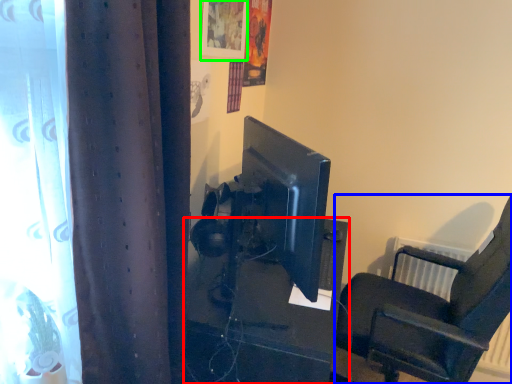
Question: Which is farther away from furniture (highlighted by a red box)? chair (highlighted by a blue box) or picture frame (highlighted by a green box)?

Choices:
 (A) chair
 (B) picture frame

Answer: (B)